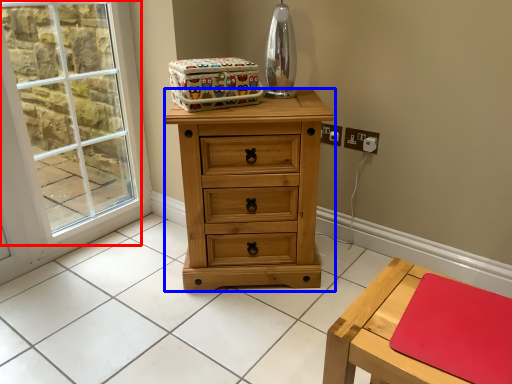
Question: Which object is further to the camera taking this photo, window (highlighted by a red box) or chest of drawers (highlighted by a blue box)?

Choices:
 (A) window
 (B) chest of drawers

Answer: (A)